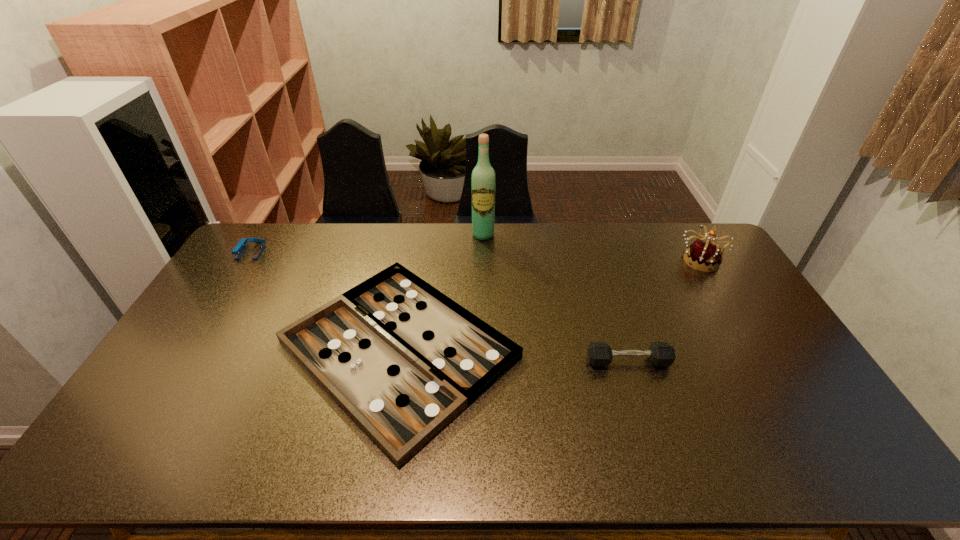
Find the location of a particular element. Image resolution: width=960 pixels, height=540 pixels. object at the far right corner is located at coordinates (705, 255).

The image size is (960, 540). Identify the location of free region at the far edge. (498, 243).

This screenshot has height=540, width=960. What are the coordinates of `vacant area at the near edge of the desktop` in the screenshot? It's located at (473, 444).

Identify the location of vacant space at the right edge. (768, 407).

Locate an element on the screen. This screenshot has height=540, width=960. blank space at the far right corner is located at coordinates (676, 231).

Where is `free space between the gameboard and the stapler`? free space between the gameboard and the stapler is located at coordinates (324, 300).

This screenshot has width=960, height=540. I want to click on vacant point located between the rightmost object and the farthest object, so click(591, 247).

Find the location of a particular element. The height and width of the screenshot is (540, 960). vacant space that is in between the fourth tallest object and the wine bottle is located at coordinates (556, 298).

This screenshot has height=540, width=960. In order to click on free space between the leftmost object and the gameboard in this screenshot , I will do `click(324, 300)`.

The height and width of the screenshot is (540, 960). I want to click on free space between the tiara and the dumbbell, so click(x=664, y=310).